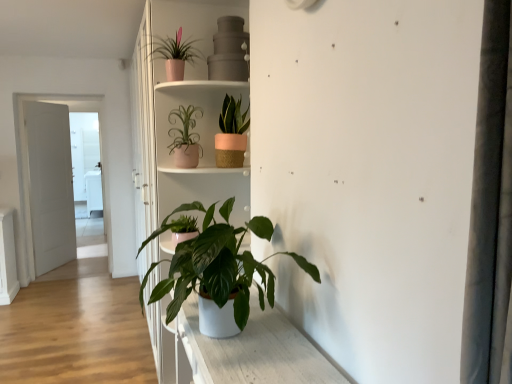
Question: Which direction should I rotate to look at pink matte pot at upper center, the 4th houseplant when ordered from bottom to top, — up or down?

Choices:
 (A) down
 (B) up

Answer: (B)

Question: Is matte pink pot at upper center, acting as the second houseplant starting from the bottom, closer to the viewer compared to white matte door at left?

Choices:
 (A) no
 (B) yes

Answer: (B)

Question: Is white matte door at left completely or partially inside matte pink pot at upper center, acting as the second houseplant starting from the bottom?

Choices:
 (A) no
 (B) yes

Answer: (A)

Question: Is matte pink pot at upper center, acting as the second houseplant starting from the bottom, facing away from white matte door at left?

Choices:
 (A) no
 (B) yes

Answer: (A)

Question: Can you confirm if matte pink pot at upper center, which is the third houseplant in top-to-bottom order, is positioned to the right of white matte door at left?

Choices:
 (A) yes
 (B) no

Answer: (A)

Question: From the image's perspective, is matte pink pot at upper center, acting as the second houseplant starting from the bottom, over white matte door at left?

Choices:
 (A) no
 (B) yes

Answer: (B)

Question: Can you confirm if matte pink pot at upper center, acting as the second houseplant starting from the bottom, is wider than white matte door at left?

Choices:
 (A) no
 (B) yes

Answer: (B)

Question: Is the surface of green matte plant at center, which is counted as the 1th houseplant, starting from the bottom, in direct contact with white matte door at left?

Choices:
 (A) yes
 (B) no

Answer: (B)

Question: Could you tell me if green matte plant at center, which is counted as the 1th houseplant, starting from the bottom, is facing white matte door at left?

Choices:
 (A) no
 (B) yes

Answer: (A)

Question: Can you confirm if green matte plant at center, which is counted as the 1th houseplant, starting from the bottom, is smaller than white matte door at left?

Choices:
 (A) yes
 (B) no

Answer: (A)

Question: Can you confirm if green matte plant at center, positioned as the 4th houseplant in top-to-bottom order, is shorter than white matte door at left?

Choices:
 (A) yes
 (B) no

Answer: (A)

Question: Is green matte plant at center, positioned as the 4th houseplant in top-to-bottom order, behind white matte door at left?

Choices:
 (A) no
 (B) yes

Answer: (A)

Question: Is green matte plant at center, positioned as the 4th houseplant in top-to-bottom order, at the right side of white matte door at left?

Choices:
 (A) yes
 (B) no

Answer: (A)

Question: Can you confirm if green matte plant at center, positioned as the 4th houseplant in top-to-bottom order, is taller than matte pink woven pot at upper center, the 2th houseplant positioned from the top?

Choices:
 (A) yes
 (B) no

Answer: (A)